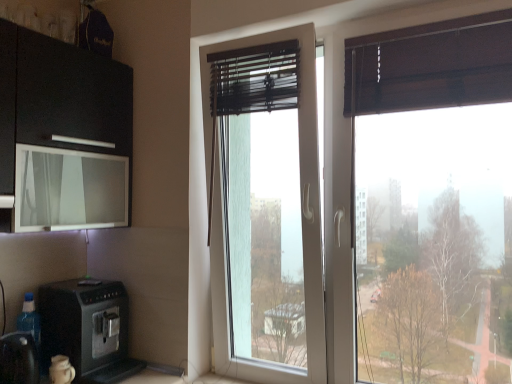
Question: Is black plastic coffee machine at lower left far away from transparent glass window at center?

Choices:
 (A) no
 (B) yes

Answer: (A)

Question: Is the position of black plastic coffee machine at lower left less distant than that of transparent glass window at center?

Choices:
 (A) yes
 (B) no

Answer: (A)

Question: Does black plastic coffee machine at lower left have a lesser width compared to transparent glass window at center?

Choices:
 (A) yes
 (B) no

Answer: (B)

Question: Considering the relative positions of black plastic coffee machine at lower left and transparent glass window at center in the image provided, is black plastic coffee machine at lower left to the right of transparent glass window at center from the viewer's perspective?

Choices:
 (A) no
 (B) yes

Answer: (A)

Question: From the image's perspective, is black plastic coffee machine at lower left located beneath transparent glass window at center?

Choices:
 (A) yes
 (B) no

Answer: (A)

Question: In terms of height, does transparent glass window screen at upper left look taller or shorter compared to black plastic coffee machine at lower left?

Choices:
 (A) tall
 (B) short

Answer: (B)

Question: From the image's perspective, is transparent glass window screen at upper left positioned above or below black plastic coffee machine at lower left?

Choices:
 (A) below
 (B) above

Answer: (B)

Question: In the image, is transparent glass window screen at upper left positioned in front of or behind black plastic coffee machine at lower left?

Choices:
 (A) front
 (B) behind

Answer: (A)

Question: Does point (117, 210) appear closer or farther from the camera than point (90, 344)?

Choices:
 (A) closer
 (B) farther

Answer: (B)

Question: From a real-world perspective, is black plastic coffee machine at lower left above or below transparent glass window screen at upper left?

Choices:
 (A) below
 (B) above

Answer: (A)

Question: Considering the positions of black plastic coffee machine at lower left and transparent glass window screen at upper left in the image, is black plastic coffee machine at lower left bigger or smaller than transparent glass window screen at upper left?

Choices:
 (A) small
 (B) big

Answer: (A)

Question: From the image's perspective, is black plastic coffee machine at lower left above or below transparent glass window screen at upper left?

Choices:
 (A) below
 (B) above

Answer: (A)

Question: Considering their positions, is black plastic coffee machine at lower left located in front of or behind transparent glass window screen at upper left?

Choices:
 (A) behind
 (B) front

Answer: (B)

Question: Looking at their shapes, would you say black plastic coffee machine at lower left is wider or thinner than black plastic coffee machine at lower left?

Choices:
 (A) wide
 (B) thin

Answer: (B)

Question: From a real-world perspective, is black plastic coffee machine at lower left above or below black plastic coffee machine at lower left?

Choices:
 (A) below
 (B) above

Answer: (A)